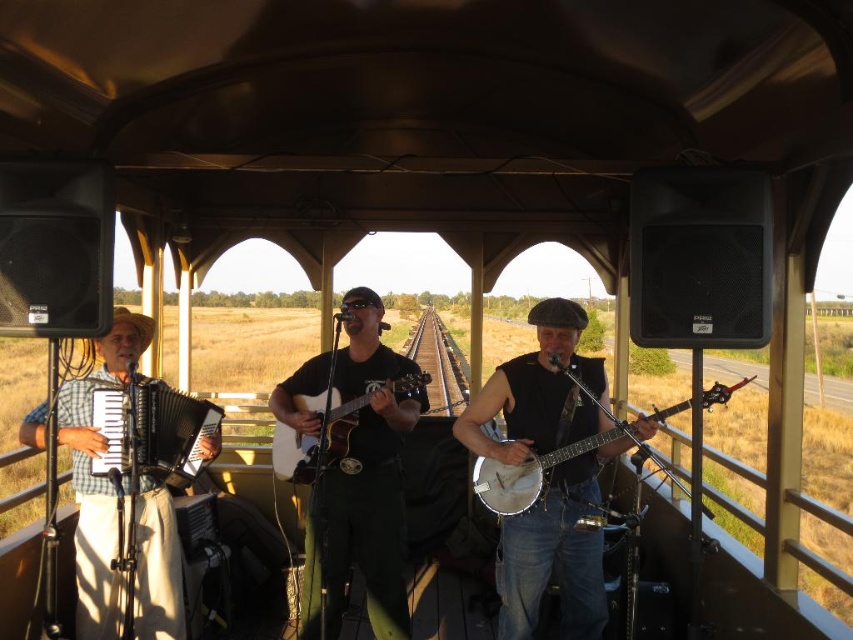
Does black leather guitar at center have a larger size compared to wooden banjo at center?

Indeed, black leather guitar at center has a larger size compared to wooden banjo at center.

Does black leather guitar at center lie in front of wooden banjo at center?

No, it is not.

This screenshot has height=640, width=853. Identify the location of black leather guitar at center. (357, 476).

Who is more distant from viewer, (567,358) or (332,381)?

Point (332,381)

Locate an element on the screen. denim jeans at center is located at coordinates (556, 554).

How far apart are denim jeans at center and wooden banjo at center?

denim jeans at center is 21.28 centimeters from wooden banjo at center.

Which is in front, point (550, 529) or point (521, 497)?

Point (521, 497)

Where is `denim jeans at center`? The height and width of the screenshot is (640, 853). denim jeans at center is located at coordinates (556, 554).